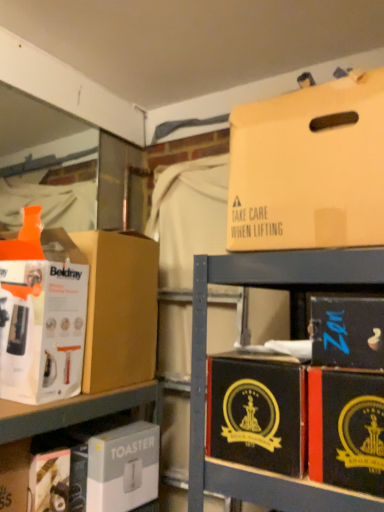
Question: Is white cardboard toaster at lower center, the 7th box viewed from the top, turned away from white cardboard box at lower left?

Choices:
 (A) yes
 (B) no

Answer: (B)

Question: Is white cardboard toaster at lower center, the 7th box viewed from the top, taller than white cardboard box at lower left?

Choices:
 (A) yes
 (B) no

Answer: (B)

Question: Is white cardboard toaster at lower center, the 1th box ordered from the bottom, to the left of white cardboard box at lower left from the viewer's perspective?

Choices:
 (A) no
 (B) yes

Answer: (A)

Question: From a real-world perspective, is white cardboard toaster at lower center, the 1th box ordered from the bottom, on white cardboard box at lower left?

Choices:
 (A) no
 (B) yes

Answer: (A)

Question: Does white cardboard toaster at lower center, the 7th box viewed from the top, have a smaller size compared to white cardboard box at lower left?

Choices:
 (A) no
 (B) yes

Answer: (A)

Question: Is white cardboard toaster at lower center, the 7th box viewed from the top, not within white cardboard box at lower left?

Choices:
 (A) yes
 (B) no

Answer: (A)

Question: From a real-world perspective, is black cardboard box at lower right, arranged as the fifth box when viewed from the top, located higher than beige cardboard box at upper right, which is counted as the 7th box, starting from the bottom?

Choices:
 (A) no
 (B) yes

Answer: (A)

Question: From the image's perspective, is black cardboard box at lower right, arranged as the fifth box when viewed from the top, above beige cardboard box at upper right, the 1th box viewed from the top?

Choices:
 (A) yes
 (B) no

Answer: (B)

Question: From a real-world perspective, does black cardboard box at lower right, placed as the third box when sorted from bottom to top, sit lower than beige cardboard box at upper right, the 1th box viewed from the top?

Choices:
 (A) no
 (B) yes

Answer: (B)

Question: Is black cardboard box at lower right, arranged as the fifth box when viewed from the top, with beige cardboard box at upper right, which is counted as the 7th box, starting from the bottom?

Choices:
 (A) yes
 (B) no

Answer: (B)

Question: From the image's perspective, is black cardboard box at lower right, arranged as the fifth box when viewed from the top, beneath beige cardboard box at upper right, the 1th box viewed from the top?

Choices:
 (A) yes
 (B) no

Answer: (A)

Question: Is black cardboard box at lower right, placed as the third box when sorted from bottom to top, facing towards beige cardboard box at upper right, the 1th box viewed from the top?

Choices:
 (A) no
 (B) yes

Answer: (A)

Question: From the image's perspective, is white cardboard box at left, which is counted as the second box, starting from the top, under black cardboard box at lower right, which ranks as the 5th box in bottom-to-top order?

Choices:
 (A) yes
 (B) no

Answer: (B)